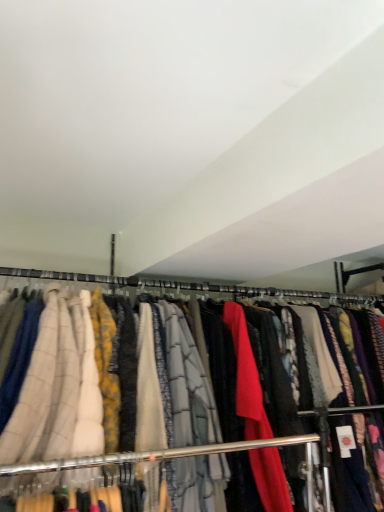
The image size is (384, 512). What do you see at coordinates (245, 375) in the screenshot?
I see `white textured pants at center` at bounding box center [245, 375].

Identify the location of white textured pants at center. (245, 375).

Identify the location of white textured pants at center. The image size is (384, 512). (x=245, y=375).